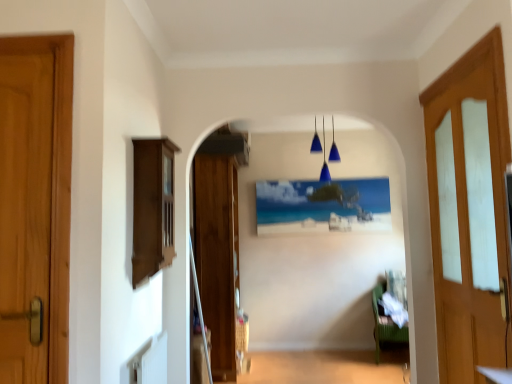
The image size is (512, 384). I want to click on free point above matte plastic picture frame at center (from a real-world perspective), so click(x=317, y=177).